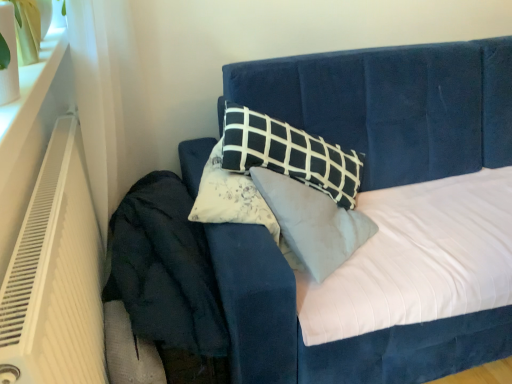
Question: Is white plastic heater at left at the left side of velvet blue bed at center?

Choices:
 (A) no
 (B) yes

Answer: (B)

Question: Can you confirm if white plastic heater at left is smaller than velvet blue bed at center?

Choices:
 (A) no
 (B) yes

Answer: (B)

Question: From the image's perspective, is white plastic heater at left over velvet blue bed at center?

Choices:
 (A) yes
 (B) no

Answer: (B)

Question: Is white plastic heater at left taller than velvet blue bed at center?

Choices:
 (A) yes
 (B) no

Answer: (B)

Question: Is white plastic heater at left oriented towards velvet blue bed at center?

Choices:
 (A) no
 (B) yes

Answer: (B)

Question: Is velvet blue bed at center at the back of white plastic heater at left?

Choices:
 (A) yes
 (B) no

Answer: (B)

Question: From the image's perspective, does dark blue velvet at lower left appear higher than velvet blue bed at center?

Choices:
 (A) no
 (B) yes

Answer: (A)

Question: Is dark blue velvet at lower left turned away from velvet blue bed at center?

Choices:
 (A) no
 (B) yes

Answer: (A)

Question: Considering the relative positions of dark blue velvet at lower left and velvet blue bed at center in the image provided, is dark blue velvet at lower left to the right of velvet blue bed at center from the viewer's perspective?

Choices:
 (A) yes
 (B) no

Answer: (B)

Question: Is dark blue velvet at lower left beside velvet blue bed at center?

Choices:
 (A) no
 (B) yes

Answer: (A)

Question: Could velvet blue bed at center be considered to be inside dark blue velvet at lower left?

Choices:
 (A) yes
 (B) no

Answer: (B)

Question: Does dark blue velvet at lower left have a greater height compared to velvet blue bed at center?

Choices:
 (A) yes
 (B) no

Answer: (B)

Question: Is dark blue velvet at lower left completely or partially inside white plastic heater at left?

Choices:
 (A) yes
 (B) no

Answer: (B)